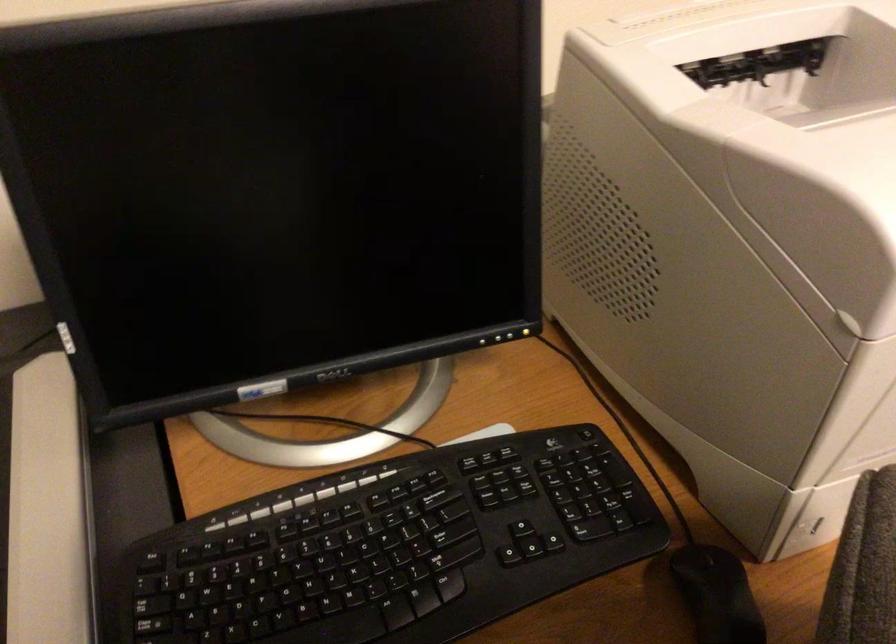
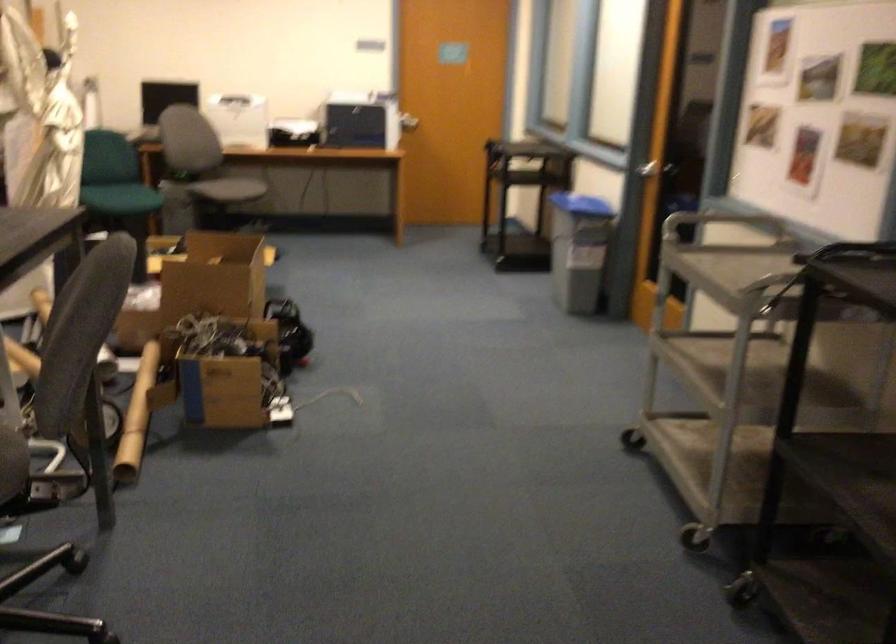
Question: I am providing you with two images of the same scene from different viewpoints. After the viewpoint changes to image2, which objects are now occluded?

Choices:
 (A) black computer mouse
 (B) grey chair sitting surface
 (C) white CD spindle
 (D) silver door handle

Answer: (A)